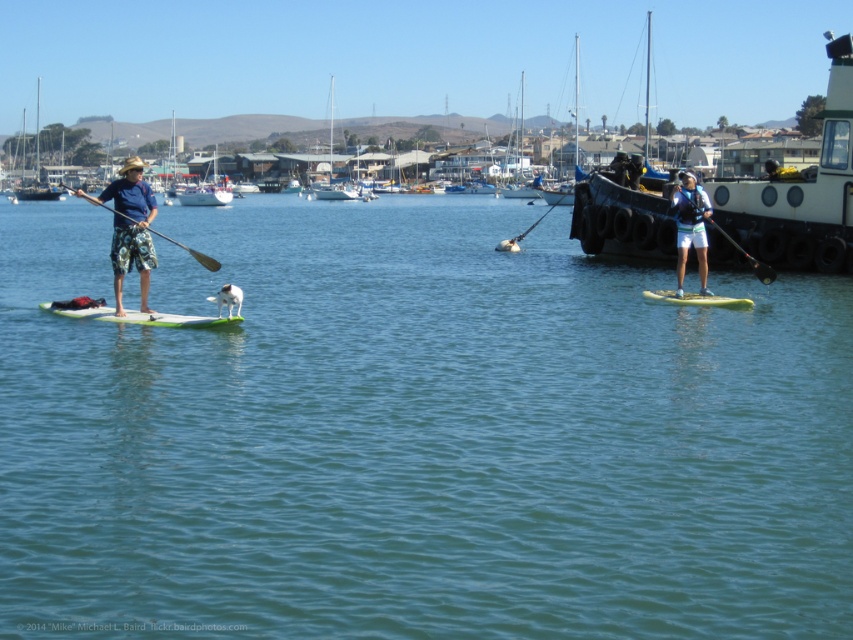
Between point (817, 259) and point (138, 243), which one is positioned behind?

Point (817, 259)

Between white rubber boat at right and camouflage shorts at left, which one is positioned higher?

white rubber boat at right is above.

Who is more forward, (807,177) or (141,252)?

Positioned in front is point (141,252).

Locate an element on the screen. Image resolution: width=853 pixels, height=640 pixels. white rubber boat at right is located at coordinates (799, 189).

Which of these two, clear blue water at center or camouflage shorts at left, stands shorter?

With less height is clear blue water at center.

What do you see at coordinates (415, 435) in the screenshot? This screenshot has height=640, width=853. I see `clear blue water at center` at bounding box center [415, 435].

Is point (33, 419) positioned behind point (140, 216)?

No, (33, 419) is in front of (140, 216).

Locate an element on the screen. clear blue water at center is located at coordinates (415, 435).

Between wooden sailboat at upper left and white plastic sailboat at center, which one is positioned lower?

wooden sailboat at upper left

Which is more to the left, wooden sailboat at upper left or white plastic sailboat at center?

wooden sailboat at upper left is more to the left.

Does point (32, 193) come behind point (521, 156)?

No.

Locate an element on the screen. The width and height of the screenshot is (853, 640). wooden sailboat at upper left is located at coordinates (36, 170).